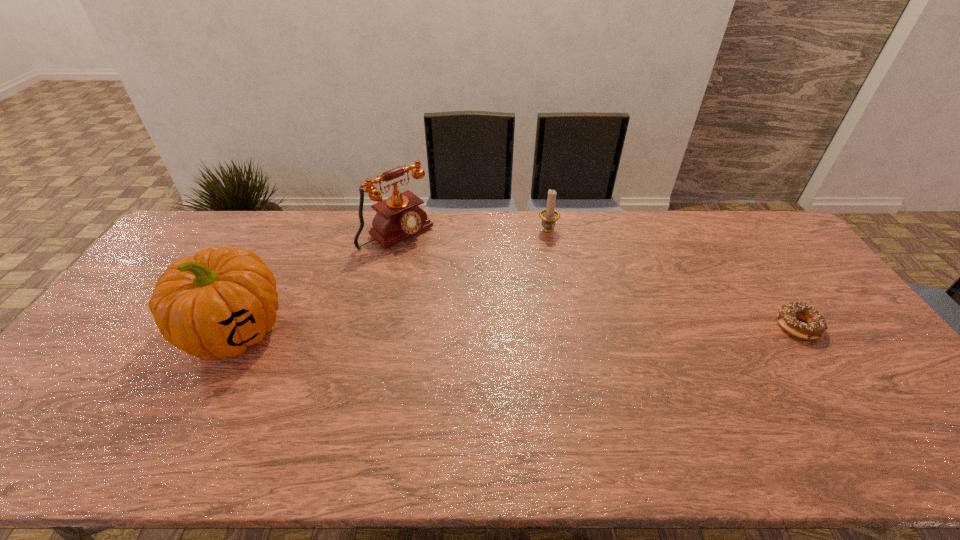
You are a GUI agent. You are given a task and a screenshot of the screen. Output one action in this format:
    pyautogui.click(x=<x>, y=<y>)
    Task: Click on the leftmost object
    This screenshot has width=960, height=540.
    Given the screenshot: What is the action you would take?
    pyautogui.click(x=213, y=306)

Locate an element on the screen. Image resolution: width=960 pixels, height=540 pixels. doughnut is located at coordinates (815, 326).

Where is `the rightmost object`? The height and width of the screenshot is (540, 960). the rightmost object is located at coordinates (815, 326).

Where is `telephone`? telephone is located at coordinates (398, 217).

Image resolution: width=960 pixels, height=540 pixels. Find the location of `the second shortest object`. the second shortest object is located at coordinates (549, 216).

The image size is (960, 540). What are the coordinates of `candle_holder` in the screenshot? It's located at (549, 216).

Locate an element on the screen. The image size is (960, 540). free point located on the surface of the pumpkin is located at coordinates (188, 420).

At what (x,y) coordinates should I click in order to perform the action: click on free space located 0.380m on the back of the doughnut. Please return your answer as a coordinate pair (x, y). Looking at the image, I should click on (732, 231).

This screenshot has width=960, height=540. Identify the location of free space located on the dial of the third object from right to left. (460, 282).

This screenshot has height=540, width=960. Identify the location of free location located on the dial of the third object from right to left. (430, 257).